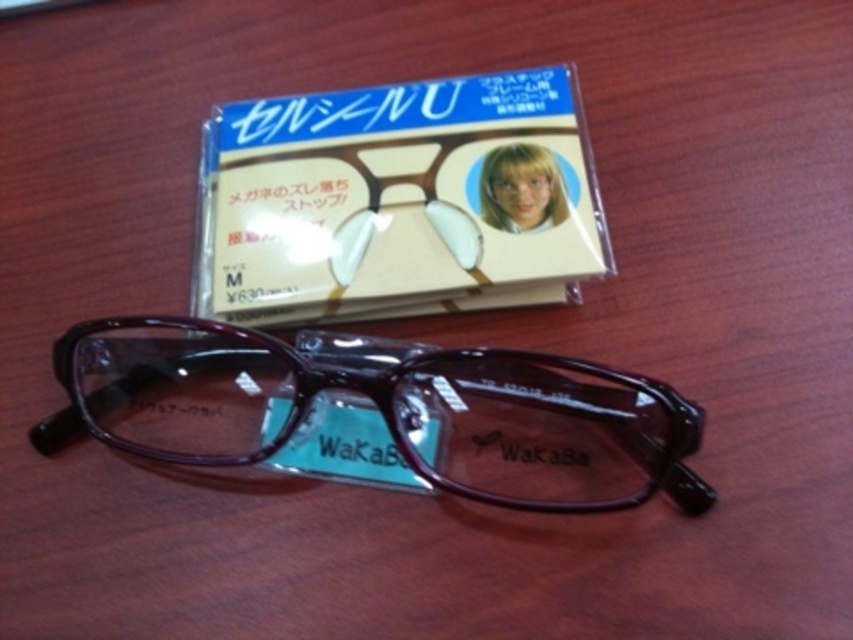
Is clear plastic case at upper center bigger than shiny brown glasses at center?

No, clear plastic case at upper center is not bigger than shiny brown glasses at center.

Who is more forward, (550, 180) or (267, 396)?

Point (267, 396) is more forward.

This screenshot has width=853, height=640. I want to click on clear plastic case at upper center, so click(x=398, y=202).

The image size is (853, 640). Find the location of `clear plastic case at upper center`. clear plastic case at upper center is located at coordinates (398, 202).